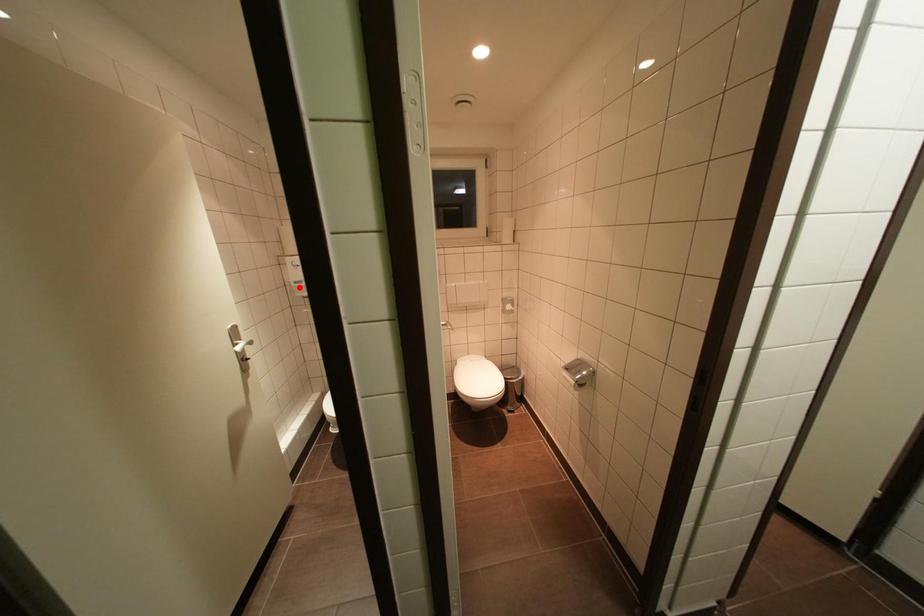
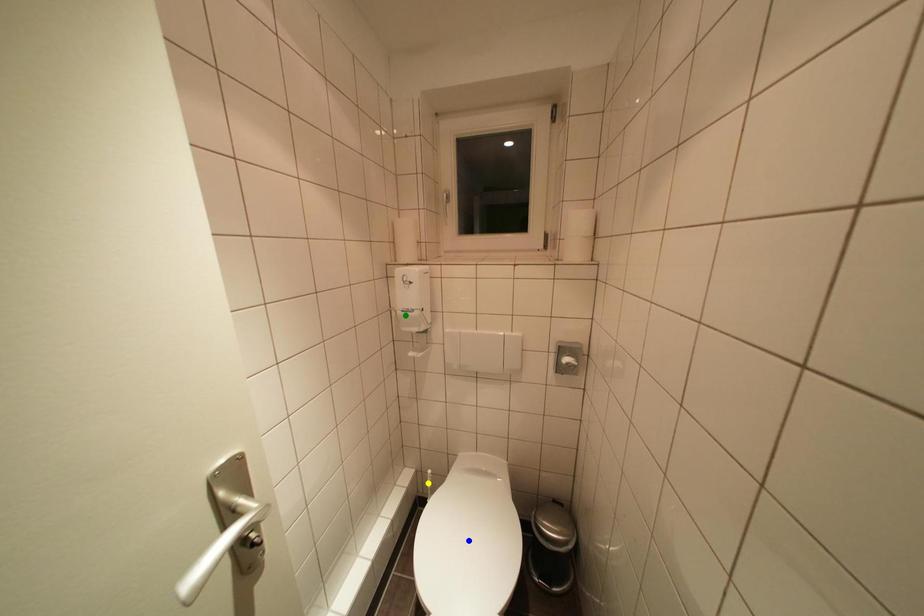
Question: I am providing you with two images of the same scene from different viewpoints. A red point is marked on the first image. You are given multiple points on the second image. Which spot in image 2 lines up with the point in image 1?

Choices:
 (A) green point
 (B) yellow point
 (C) blue point

Answer: (A)